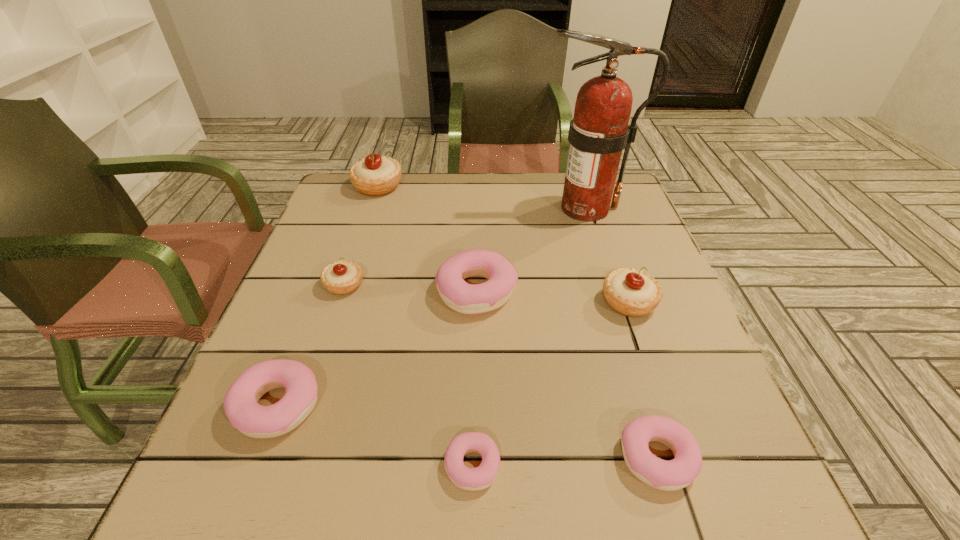
Where is `free space between the biggest pink pastry and the leftmost pink pastry`? This screenshot has width=960, height=540. free space between the biggest pink pastry and the leftmost pink pastry is located at coordinates (377, 348).

Locate an element on the screen. The image size is (960, 540). vacant space in between the sixth shortest object and the seventh tallest object is located at coordinates (643, 380).

Where is `vacant area between the smallest beige pastry and the second tallest object`? The height and width of the screenshot is (540, 960). vacant area between the smallest beige pastry and the second tallest object is located at coordinates (361, 235).

Find the location of a particular element. This screenshot has width=960, height=540. free spot between the tallest object and the fifth tallest pastry is located at coordinates (432, 307).

The height and width of the screenshot is (540, 960). I want to click on vacant area between the red fire extinguisher and the second shortest pastry, so click(621, 333).

You are a GUI agent. You are given a task and a screenshot of the screen. Output one action in this format:
    pyautogui.click(x=<x>, y=<y>)
    Task: Click on the vacant area that lies between the biggest pink pastry and the rightmost pink pastry
    This screenshot has width=960, height=540.
    Given the screenshot: What is the action you would take?
    pyautogui.click(x=567, y=374)

Choose which object is the nearest neighbor to the sixth tallest pastry. Please provide its 2D coordinates. Your answer should be formatted as a tuple, i.e. [(x, y)], where the tuple contains the x and y coordinates of a point satisfying the conditions above.

[(473, 479)]

This screenshot has height=540, width=960. Identify the location of the third closest object relative to the third shortest pastry. (473, 479).

Identify which pastry is the closest to the fire extinguisher. Please provide its 2D coordinates. Your answer should be formatted as a tuple, i.e. [(x, y)], where the tuple contains the x and y coordinates of a point satisfying the conditions above.

[(465, 298)]

Where is `pastry that is the sixth nearest to the smallest beige pastry`? The height and width of the screenshot is (540, 960). pastry that is the sixth nearest to the smallest beige pastry is located at coordinates (675, 474).